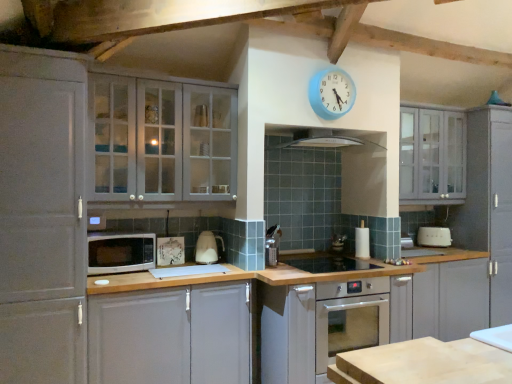
Question: From a real-world perspective, is white glossy electric kettle at center, which ranks as the second appliance in front-to-back order, beneath matte gray cabinet at upper right, the first cabinetry from the right?

Choices:
 (A) no
 (B) yes

Answer: (B)

Question: Is white glossy electric kettle at center, which is the 3th appliance from back to front, turned away from matte gray cabinet at upper right, the first cabinetry from the right?

Choices:
 (A) yes
 (B) no

Answer: (B)

Question: Considering the relative sizes of white glossy electric kettle at center, acting as the 4th appliance starting from the right, and matte gray cabinet at upper right, the first cabinetry from the right, in the image provided, is white glossy electric kettle at center, acting as the 4th appliance starting from the right, shorter than matte gray cabinet at upper right, the first cabinetry from the right,?

Choices:
 (A) yes
 (B) no

Answer: (A)

Question: Is white glossy electric kettle at center, which is the 3th appliance from back to front, located outside matte gray cabinet at upper right, the fourth cabinetry in the left-to-right sequence?

Choices:
 (A) no
 (B) yes

Answer: (B)

Question: Is white glossy electric kettle at center, which ranks as the second appliance in front-to-back order, at the right side of matte gray cabinet at upper right, the fourth cabinetry in the left-to-right sequence?

Choices:
 (A) no
 (B) yes

Answer: (A)

Question: Is white glossy electric kettle at center, which is the 3th appliance from back to front, positioned before matte gray cabinet at upper right, the first cabinetry from the right?

Choices:
 (A) yes
 (B) no

Answer: (A)

Question: Is shiny stainless steel sink at center, the fourth appliance when ordered from back to front, bigger than matte gray cabinet at left, the 4th cabinetry in the right-to-left sequence?

Choices:
 (A) yes
 (B) no

Answer: (B)

Question: From a real-world perspective, is shiny stainless steel sink at center, the fourth appliance when ordered from back to front, under matte gray cabinet at left, the 4th cabinetry in the right-to-left sequence?

Choices:
 (A) yes
 (B) no

Answer: (A)

Question: From the image's perspective, is shiny stainless steel sink at center, the fourth appliance when ordered from back to front, beneath matte gray cabinet at left, the 4th cabinetry in the right-to-left sequence?

Choices:
 (A) yes
 (B) no

Answer: (A)

Question: Can you confirm if shiny stainless steel sink at center, positioned as the 2th appliance in left-to-right order, is wider than matte gray cabinet at left, the 4th cabinetry in the right-to-left sequence?

Choices:
 (A) no
 (B) yes

Answer: (B)

Question: Is shiny stainless steel sink at center, positioned as the third appliance in right-to-left order, shorter than matte gray cabinet at left, the first cabinetry when ordered from left to right?

Choices:
 (A) yes
 (B) no

Answer: (A)

Question: Is shiny stainless steel sink at center, positioned as the third appliance in right-to-left order, directly adjacent to matte gray cabinet at left, the 4th cabinetry in the right-to-left sequence?

Choices:
 (A) no
 (B) yes

Answer: (A)

Question: Is white matte cabinet at lower left, the 3th cabinetry viewed from the left, smaller than matte gray cabinet at upper left, which ranks as the 3th cabinetry in right-to-left order?

Choices:
 (A) yes
 (B) no

Answer: (B)